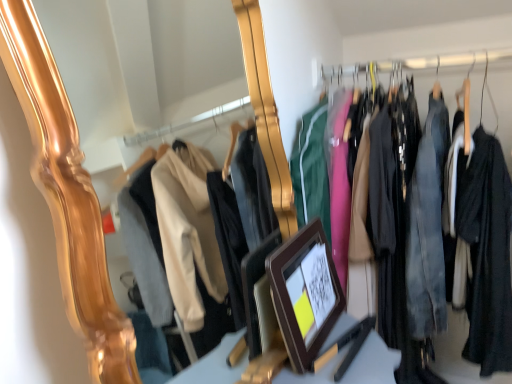
Question: Based on their sizes in the image, would you say matte black jackets at center is bigger or smaller than brown wooden picture frame at center?

Choices:
 (A) small
 (B) big

Answer: (B)

Question: Is matte black jackets at center in front of or behind brown wooden picture frame at center in the image?

Choices:
 (A) behind
 (B) front

Answer: (A)

Question: Does point (359, 294) appear closer or farther from the camera than point (270, 268)?

Choices:
 (A) closer
 (B) farther

Answer: (B)

Question: Considering the positions of brown wooden picture frame at center and matte black jackets at center in the image, is brown wooden picture frame at center taller or shorter than matte black jackets at center?

Choices:
 (A) tall
 (B) short

Answer: (B)

Question: Based on their positions, is brown wooden picture frame at center located to the left or right of matte black jackets at center?

Choices:
 (A) right
 (B) left

Answer: (B)

Question: In terms of width, does brown wooden picture frame at center look wider or thinner when compared to matte black jackets at center?

Choices:
 (A) wide
 (B) thin

Answer: (B)

Question: Looking at the image, does brown wooden picture frame at center seem bigger or smaller compared to matte black jackets at center?

Choices:
 (A) small
 (B) big

Answer: (A)